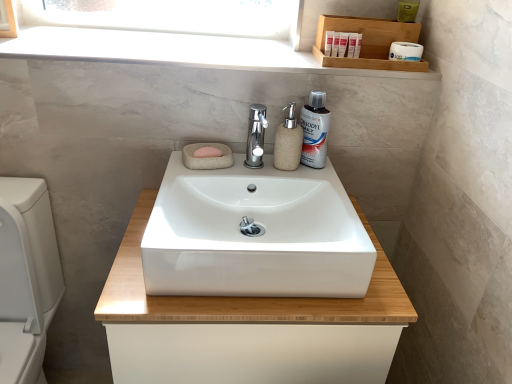
Find the location of `vacant area situated to the left side of white plastic tubes at upper right, which is the second toiletry from left to right`. vacant area situated to the left side of white plastic tubes at upper right, which is the second toiletry from left to right is located at coordinates (292, 57).